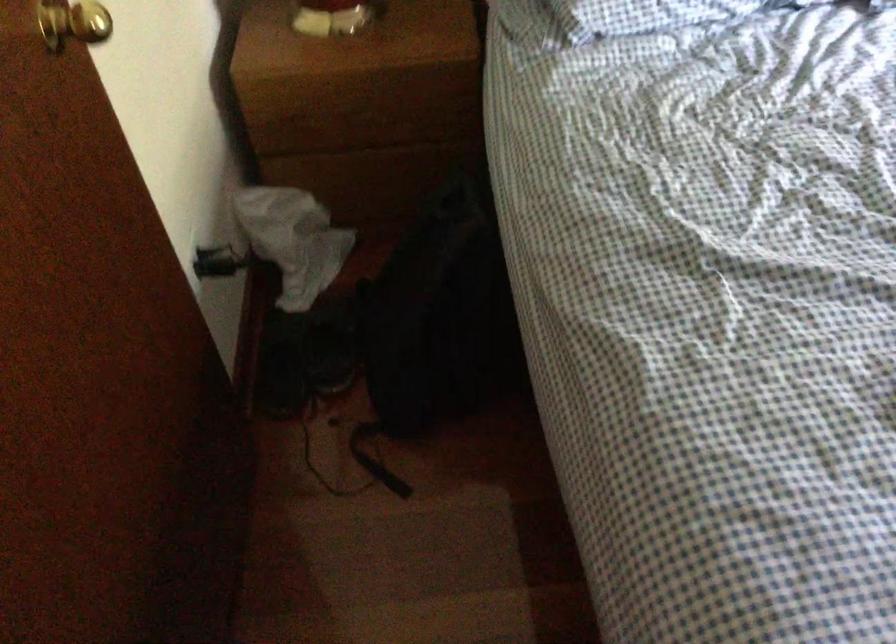
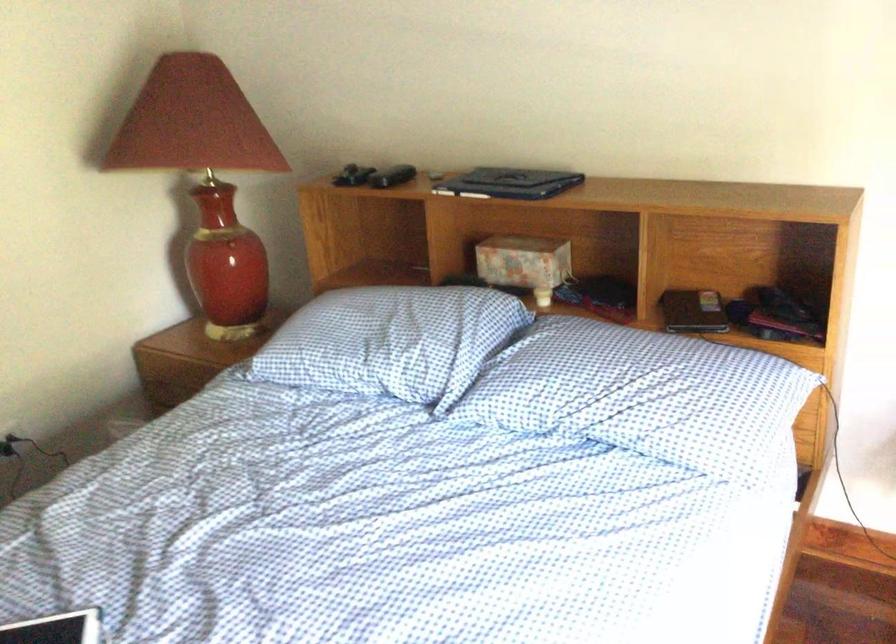
Question: I am providing you with two images of the same scene from different viewpoints. Please identify which objects are invisible in image2.

Choices:
 (A) black shoe
 (B) black electronic device
 (C) blue checkered pillow
 (D) yellow paperback book

Answer: (A)